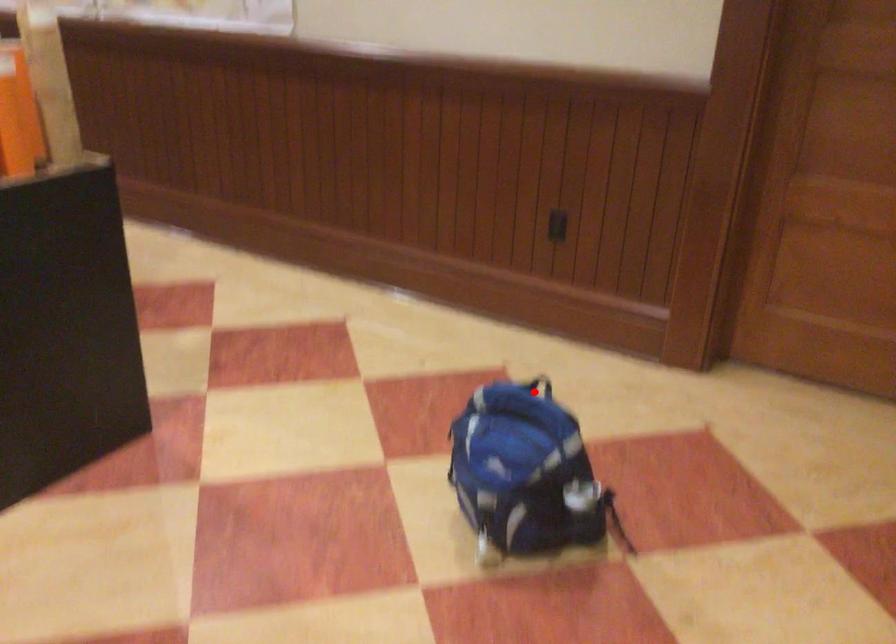
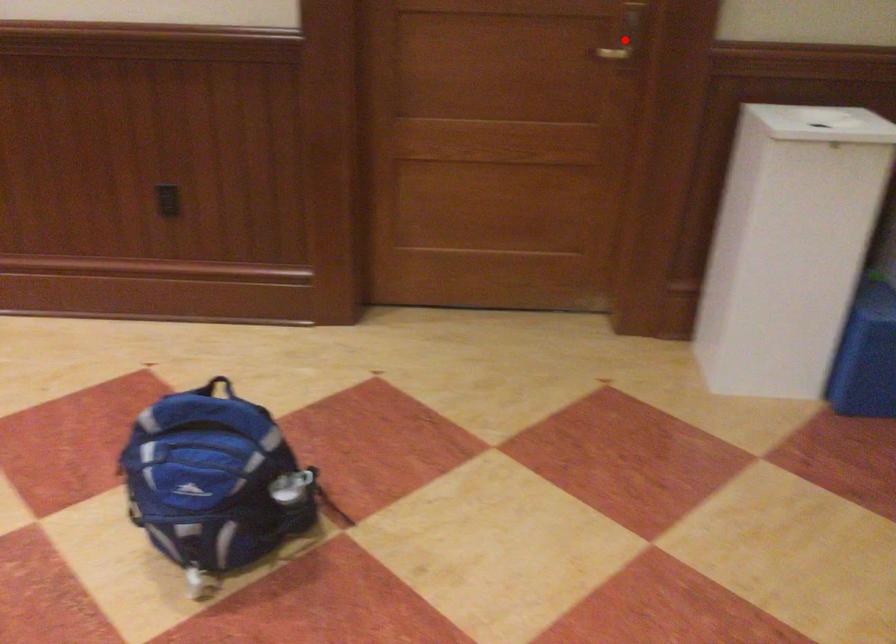
I am providing you with two images of the same scene from different viewpoints. A red point is marked on the first image and another point is marked on the second image. Do the highlighted points in image1 and image2 indicate the same real-world spot?

No